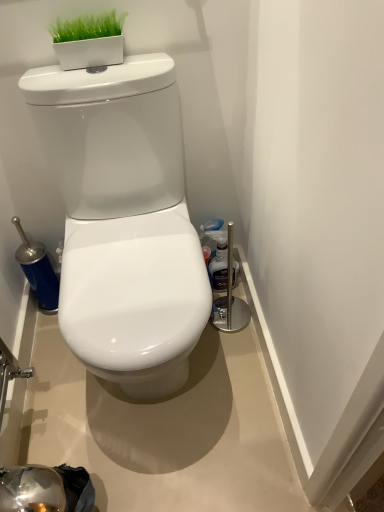
Where is `white glossy toilet at center`? The image size is (384, 512). white glossy toilet at center is located at coordinates (123, 220).

This screenshot has height=512, width=384. What do you see at coordinates (123, 220) in the screenshot?
I see `white glossy toilet at center` at bounding box center [123, 220].

Measure the distance between white glossy toilet at center and camera.

white glossy toilet at center and camera are 35.36 inches apart.

Identify the location of clear plastic bottle at right. The image size is (384, 512). (219, 265).

What do you see at coordinates (219, 265) in the screenshot? The height and width of the screenshot is (512, 384). I see `clear plastic bottle at right` at bounding box center [219, 265].

Identify the location of white glossy toilet at center. The image size is (384, 512). (123, 220).

Between white glossy toilet at center and clear plastic bottle at right, which one appears on the right side from the viewer's perspective?

Positioned to the right is clear plastic bottle at right.

Is white glossy toilet at center in front of clear plastic bottle at right?

Yes, it is in front of clear plastic bottle at right.

Considering the positions of point (202, 298) and point (218, 249), is point (202, 298) closer or farther from the camera than point (218, 249)?

Point (202, 298) is closer to the camera than point (218, 249).

From the image's perspective, who appears lower, white glossy toilet at center or clear plastic bottle at right?

white glossy toilet at center appears lower in the image.

From a real-world perspective, is white glossy toilet at center located higher than clear plastic bottle at right?

Yes.

Which object is wider, white glossy toilet at center or clear plastic bottle at right?

Wider between the two is white glossy toilet at center.

Between white glossy toilet at center and clear plastic bottle at right, which one has less height?

clear plastic bottle at right.

Who is bigger, white glossy toilet at center or clear plastic bottle at right?

white glossy toilet at center.

Is clear plastic bottle at right surrounded by white glossy toilet at center?

No, clear plastic bottle at right is located outside of white glossy toilet at center.

Is white glossy toilet at center not close to clear plastic bottle at right?

No, white glossy toilet at center is not far away from clear plastic bottle at right.

Is white glossy toilet at center oriented towards clear plastic bottle at right?

No, white glossy toilet at center is not aimed at clear plastic bottle at right.

Looking at this image, how distant is white glossy toilet at center from clear plastic bottle at right?

white glossy toilet at center and clear plastic bottle at right are 19.49 inches apart.

At what (x,y) coordinates should I click in order to perform the action: click on bottle above the white glossy toilet at center (from the image's perspective). Please return your answer as a coordinate pair (x, y). Looking at the image, I should click on (219, 265).

Does clear plastic bottle at right appear on the right side of white glossy toilet at center?

Indeed, clear plastic bottle at right is positioned on the right side of white glossy toilet at center.

Which object is closer to the camera taking this photo, clear plastic bottle at right or white glossy toilet at center?

white glossy toilet at center is more forward.

Considering the points (219, 289) and (80, 141), which point is in front, point (219, 289) or point (80, 141)?

The point (80, 141) is in front.

From the image's perspective, relative to white glossy toilet at center, is clear plastic bottle at right above or below?

Clearly, from the image's perspective, clear plastic bottle at right is above white glossy toilet at center.

Based on the photo, from a real-world perspective, between clear plastic bottle at right and white glossy toilet at center, who is vertically lower?

From a 3D spatial view, clear plastic bottle at right is below.

Is clear plastic bottle at right wider than white glossy toilet at center?

In fact, clear plastic bottle at right might be narrower than white glossy toilet at center.

Considering the relative sizes of clear plastic bottle at right and white glossy toilet at center in the image provided, is clear plastic bottle at right taller than white glossy toilet at center?

Incorrect, the height of clear plastic bottle at right is not larger of that of white glossy toilet at center.

Based on their sizes in the image, would you say clear plastic bottle at right is bigger or smaller than white glossy toilet at center?

Clearly, clear plastic bottle at right is smaller in size than white glossy toilet at center.

Could white glossy toilet at center be considered to be inside clear plastic bottle at right?

No, white glossy toilet at center is not inside clear plastic bottle at right.

Are clear plastic bottle at right and white glossy toilet at center beside each other?

No, clear plastic bottle at right is not touching white glossy toilet at center.

Based on the photo, is clear plastic bottle at right oriented away from white glossy toilet at center?

No, clear plastic bottle at right is not facing the opposite direction of white glossy toilet at center.

What's the angular difference between clear plastic bottle at right and white glossy toilet at center's facing directions?

1.09 degrees separate the facing orientations of clear plastic bottle at right and white glossy toilet at center.

How much distance is there between clear plastic bottle at right and white glossy toilet at center?

The distance of clear plastic bottle at right from white glossy toilet at center is 19.49 inches.

You are a GUI agent. You are given a task and a screenshot of the screen. Output one action in this format:
    pyautogui.click(x=<x>, y=<y>)
    Task: Click on the toilet lying on the left of clear plastic bottle at right
    The image size is (384, 512).
    Given the screenshot: What is the action you would take?
    pyautogui.click(x=123, y=220)

Where is `toilet located below the clear plastic bottle at right (from the image's perspective)`? This screenshot has width=384, height=512. toilet located below the clear plastic bottle at right (from the image's perspective) is located at coordinates (123, 220).

Image resolution: width=384 pixels, height=512 pixels. Find the location of `toilet on the left of clear plastic bottle at right`. toilet on the left of clear plastic bottle at right is located at coordinates [x=123, y=220].